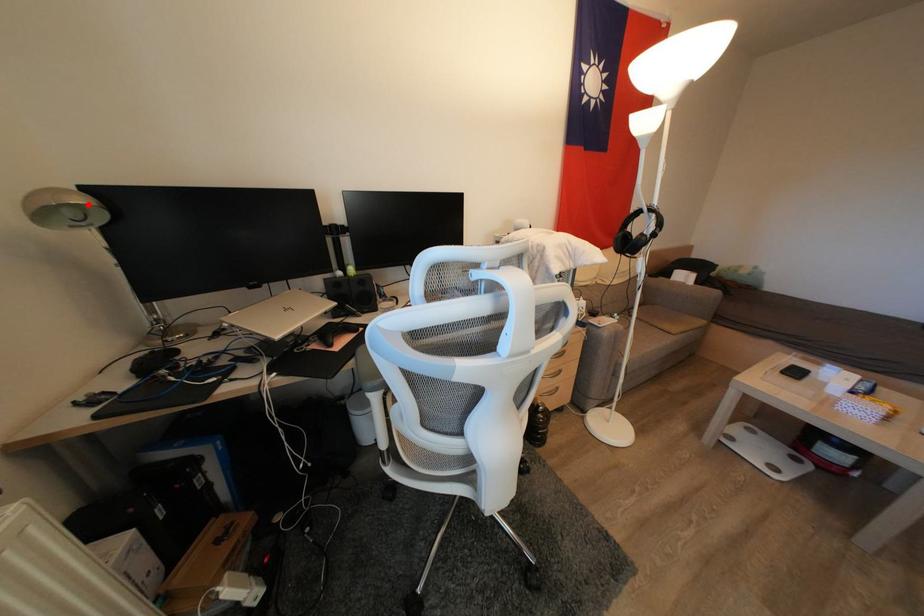
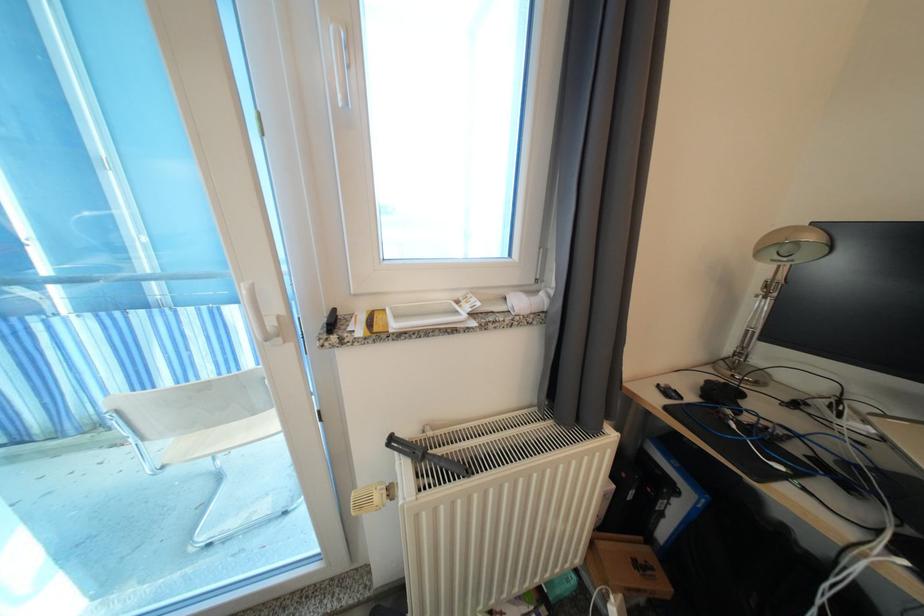
In the second image, find the point that corresponds to the highlighted location in the first image.

(818, 241)